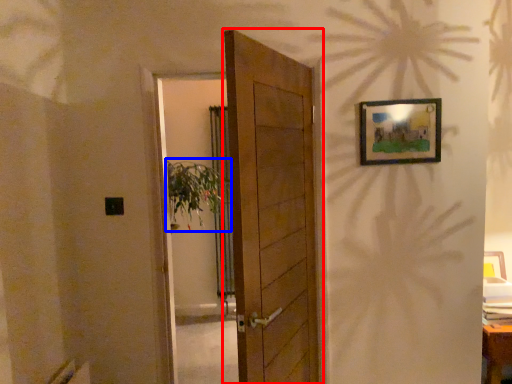
Question: Among these objects, which one is nearest to the camera, door (highlighted by a red box) or plant (highlighted by a blue box)?

Choices:
 (A) door
 (B) plant

Answer: (A)